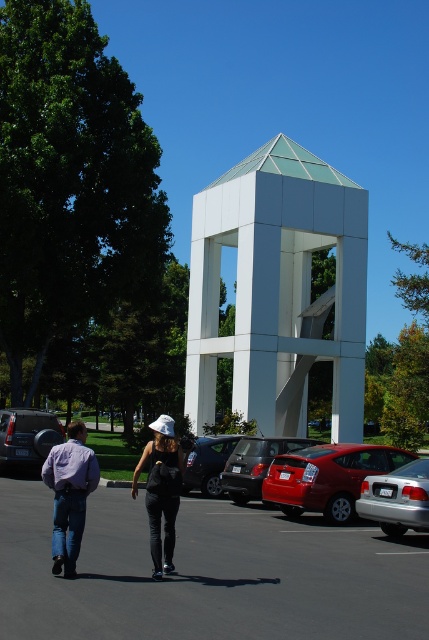
Question: Which object is positioned closest to the denim jeans at left?

Choices:
 (A) matte black car at left
 (B) matte silver helmet at center
 (C) silver metallic sedan at center

Answer: (B)

Question: Where is white matte tower at center located in relation to silver metallic sedan at center in the image?

Choices:
 (A) above
 (B) below

Answer: (A)

Question: Which object is positioned farthest from the gray asphalt parking lot at center?

Choices:
 (A) matte black car at left
 (B) shiny red car at lower right

Answer: (A)

Question: Considering the relative positions of gray asphalt parking lot at center and silver metallic sedan at center in the image provided, where is gray asphalt parking lot at center located with respect to silver metallic sedan at center?

Choices:
 (A) right
 (B) left

Answer: (B)

Question: Is silver metallic sedan at center thinner than glossy red car at center?

Choices:
 (A) no
 (B) yes

Answer: (A)

Question: Which of the following is the closest to the observer?

Choices:
 (A) denim jeans at left
 (B) matte black car at center
 (C) matte black car at left
 (D) gray asphalt parking lot at center

Answer: (D)